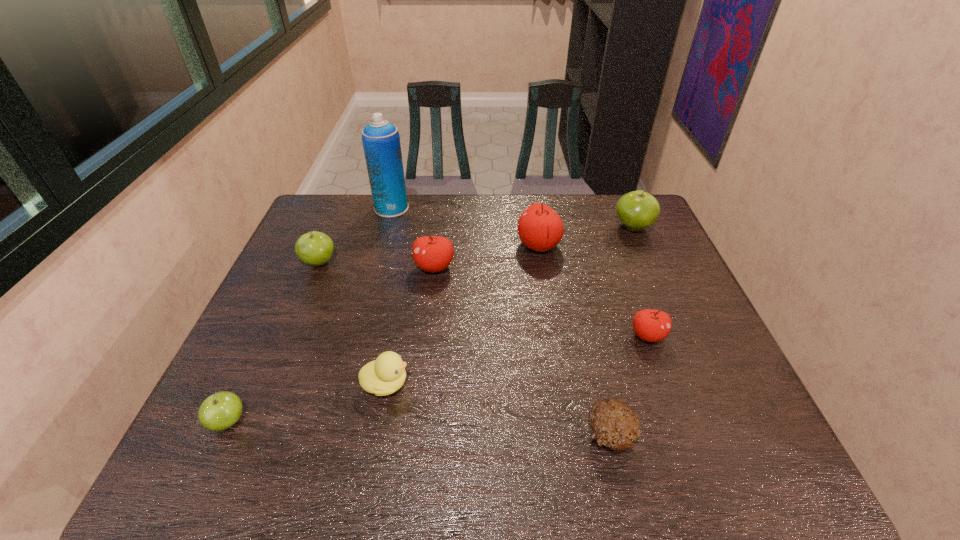
You are a GUI agent. You are given a task and a screenshot of the screen. Output one action in this format:
    pyautogui.click(x=<x>, y=<y>)
    Task: Click on the rightmost red apple
    
    Given the screenshot: What is the action you would take?
    pyautogui.click(x=650, y=325)

Find the location of a particular element. This screenshot has height=540, width=960. the smallest red apple is located at coordinates (650, 325).

Locate an element on the screen. The height and width of the screenshot is (540, 960). the nearest green apple is located at coordinates (220, 411).

In order to click on the smallest green apple in this screenshot , I will do `click(220, 411)`.

At what (x,y) coordinates should I click in order to perform the action: click on the shortest object. Please return your answer as a coordinate pair (x, y). This screenshot has width=960, height=540. Looking at the image, I should click on (614, 424).

Image resolution: width=960 pixels, height=540 pixels. I want to click on free location located 0.100m on the left of the tallest object, so click(x=346, y=208).

This screenshot has height=540, width=960. What are the coordinates of `vacant space positioned 0.180m on the left of the second red apple from left to right` in the screenshot? It's located at (459, 245).

I want to click on blank space located 0.160m on the front of the rightmost green apple, so click(x=653, y=273).

The height and width of the screenshot is (540, 960). Find the location of `vacant space located 0.180m on the left of the second smallest red apple`. vacant space located 0.180m on the left of the second smallest red apple is located at coordinates (353, 267).

The width and height of the screenshot is (960, 540). What are the coordinates of `free space located on the right of the second smallest green apple` in the screenshot? It's located at (404, 263).